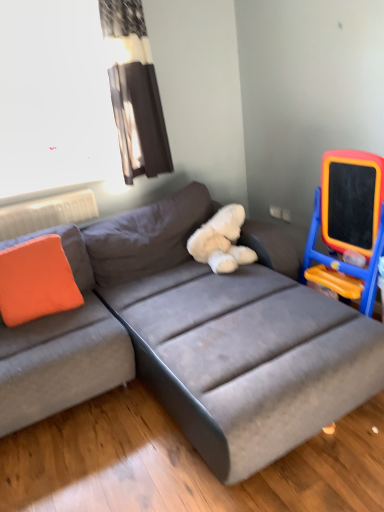
Question: From the image's perspective, is black fabric curtain at upper left located above or below orange fabric pillow at left?

Choices:
 (A) below
 (B) above

Answer: (B)

Question: Is point (137, 12) closer or farther from the camera than point (62, 279)?

Choices:
 (A) closer
 (B) farther

Answer: (B)

Question: Based on their relative distances, which object is farther from the black fabric curtain at upper left?

Choices:
 (A) gray fabric couch at center
 (B) transparent plastic window screen at upper left
 (C) white plush teddy bear at center
 (D) orange fabric pillow at left
 (E) orange plastic easel at right

Answer: (E)

Question: Estimate the real-world distances between objects in this image. Which object is farther from the orange fabric pillow at left?

Choices:
 (A) black fabric curtain at upper left
 (B) white plush teddy bear at center
 (C) gray fabric couch at center
 (D) orange plastic easel at right
 (E) transparent plastic window screen at upper left

Answer: (D)